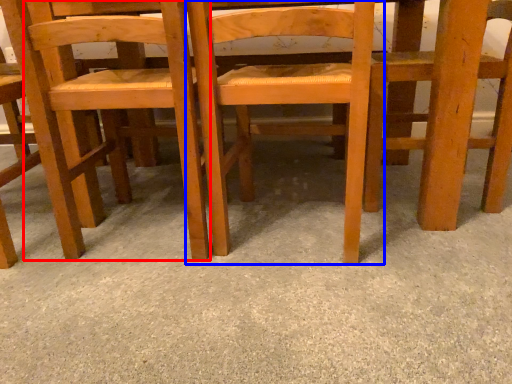
Question: Among these objects, which one is farthest to the camera, chair (highlighted by a red box) or chair (highlighted by a blue box)?

Choices:
 (A) chair
 (B) chair

Answer: (A)